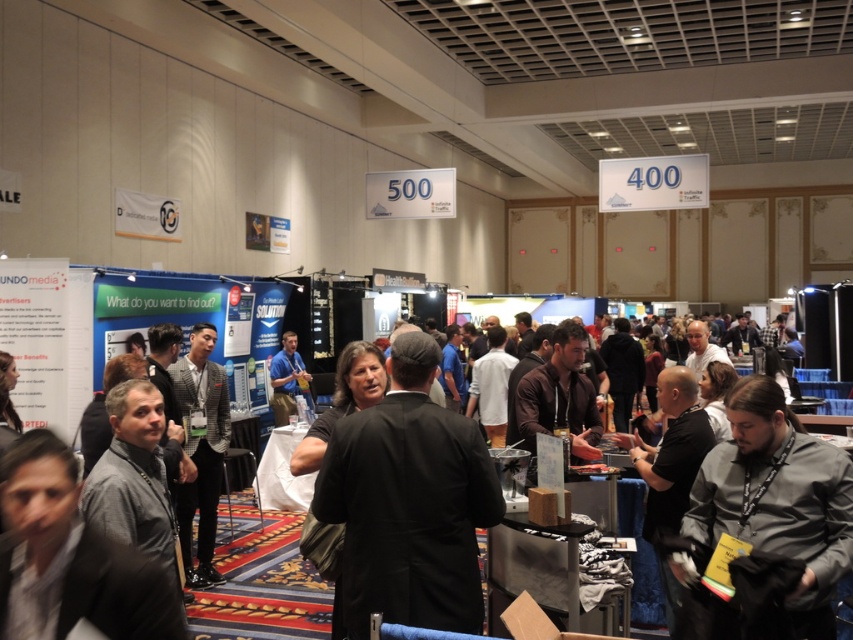
You are standing at the entrance of the event space and want to approach both the black suit at center and the gray fabric shirt at lower right. Which individual will you encounter first as you walk towards them?

You will encounter the black suit at center first because it is closer to you than the gray fabric shirt at lower right, which is further away.

You are at a trade show and need to locate the person wearing the black suit at center. According to the coordinate system where the bottom left corner is the origin, can you determine their general location?

The black suit at center is located at coordinates approximately 0.786 on the x axis and 0.481 on the y axis.

You are organizing a photo shoot and need to place a 2.5 feet wide backdrop between the black suit at center and the gray fabric shirt at lower right. Can the backdrop fit between them without overlapping either?

The black suit at center might be wider than gray fabric shirt at lower right, so the 2.5 feet wide backdrop may not fit between them if the distance between the two is less than 2.5 feet. However, since the exact distance isn not provided, it is uncertain.